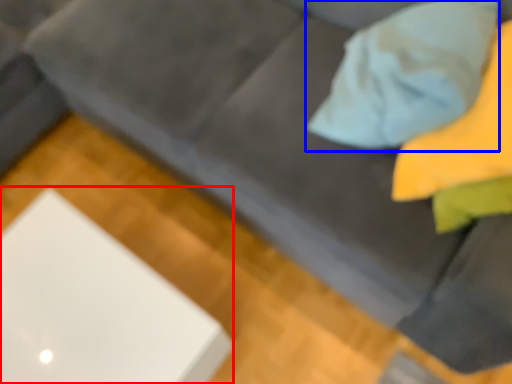
Question: Which object appears farthest to the camera in this image, computer (highlighted by a red box) or throw pillow (highlighted by a blue box)?

Choices:
 (A) computer
 (B) throw pillow

Answer: (A)